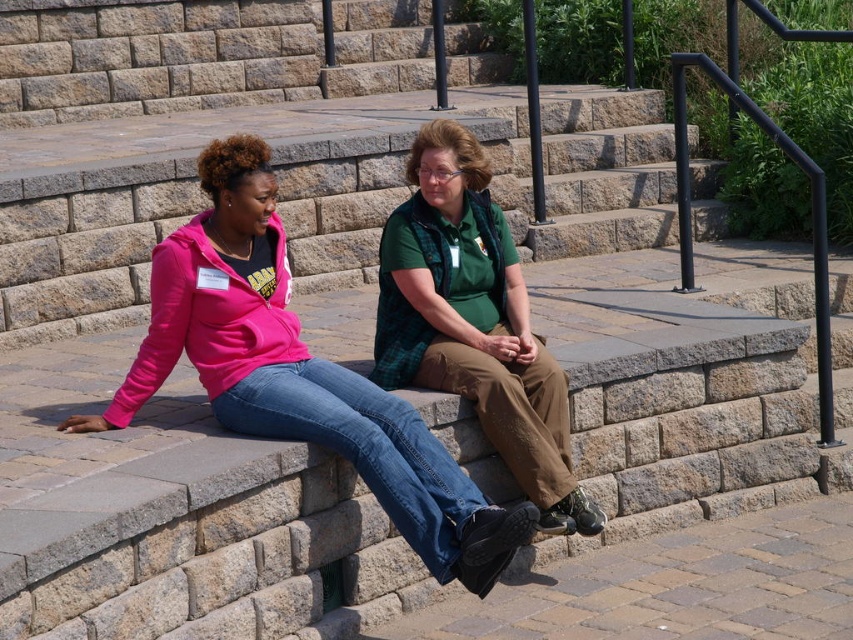
You are a photographer trying to capture a candid shot of the two people sitting on the stone bench. You want to ensure that the matte pink hoodie at center and the green plaid shirt at center are both clearly visible in the photo. Based on their positions, which clothing item is closer to the camera?

The matte pink hoodie at center is below the green plaid shirt at center, so the green plaid shirt at center is closer to the camera.

You are a photographer trying to capture a candid shot of both the matte pink hoodie at center and the green plaid shirt at center. Since you want to ensure both subjects are in frame, which direction should you position your camera relative to the two individuals?

You should position your camera to the left of the matte pink hoodie at center and the green plaid shirt at center because the matte pink hoodie at center is to the left of the green plaid shirt at center, so facing left would allow both to be captured in the frame.

You are a photographer standing in front of the two people sitting on the stone bench. You want to take a photo that clearly shows both the matte pink hoodie at center and the green plaid shirt at center. Which object should you focus on first to ensure both are in sharp focus?

You should focus on the matte pink hoodie at center first because it is closer to the viewer than the green plaid shirt at center. By focusing on the closer object, the depth of field may extend to include the farther object as well, ensuring both are in focus.